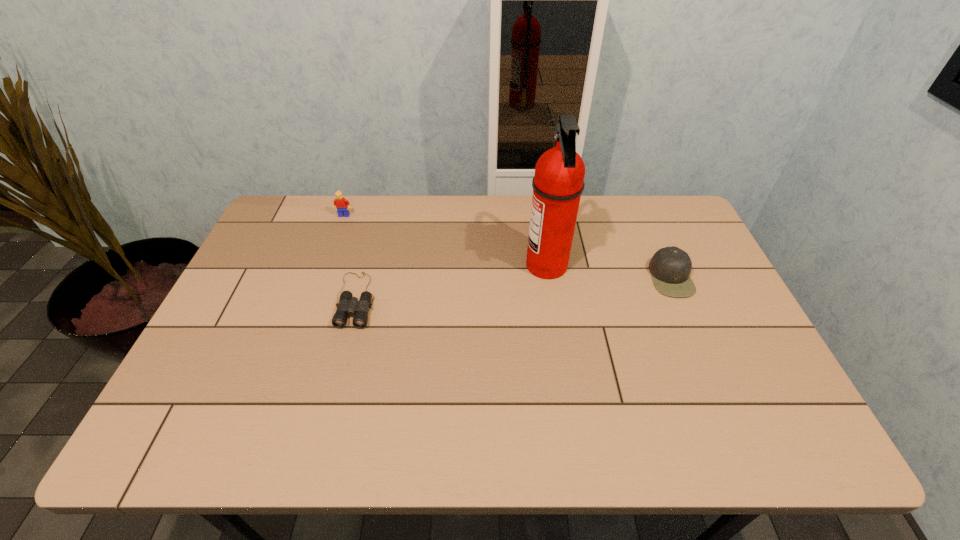
In the image, there is a desktop. Find the location of `vacant space at the left edge`. vacant space at the left edge is located at coordinates (293, 279).

In order to click on free space at the right edge in this screenshot , I will do `click(683, 303)`.

At what (x,y) coordinates should I click in order to perform the action: click on free location at the near left corner. Please return your answer as a coordinate pair (x, y). The width and height of the screenshot is (960, 540). Looking at the image, I should click on (211, 427).

At what (x,y) coordinates should I click in order to perform the action: click on vacant space at the far right corner of the desktop. Please return your answer as a coordinate pair (x, y). The height and width of the screenshot is (540, 960). Looking at the image, I should click on (651, 208).

Locate an element on the screen. This screenshot has height=540, width=960. free spot between the rightmost object and the fire extinguisher is located at coordinates (609, 272).

Where is `free point between the cap and the fire extinguisher`? The height and width of the screenshot is (540, 960). free point between the cap and the fire extinguisher is located at coordinates coord(609,272).

Identify the location of unoccupied position between the fire extinguisher and the farthest object. (445, 241).

Where is `vacant space that's between the leftmost object and the tallest object`? vacant space that's between the leftmost object and the tallest object is located at coordinates (445, 241).

At what (x,y) coordinates should I click in order to perform the action: click on vacant space that is in between the farthest object and the third tallest object. Please return your answer as a coordinate pair (x, y). This screenshot has width=960, height=540. Looking at the image, I should click on (508, 246).

What are the coordinates of `free point between the second shortest object and the farthest object` in the screenshot? It's located at (508, 246).